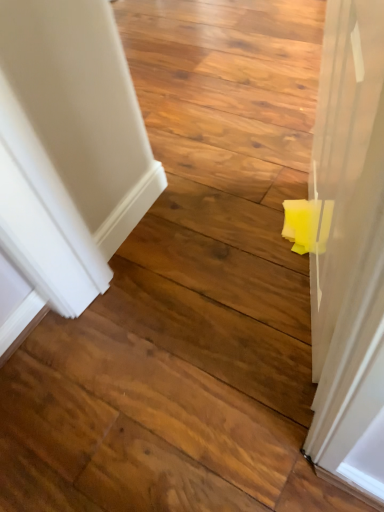
The width and height of the screenshot is (384, 512). What do you see at coordinates (349, 253) in the screenshot? I see `yellow sponge at right` at bounding box center [349, 253].

The width and height of the screenshot is (384, 512). In order to click on yellow sponge at right in this screenshot , I will do (x=349, y=253).

What is the approximate height of yellow sponge at right?

yellow sponge at right is 27.25 inches in height.

You are a GUI agent. You are given a task and a screenshot of the screen. Output one action in this format:
    pyautogui.click(x=<x>, y=<y>)
    Task: Click on the yellow sponge at right
    The image size is (384, 512).
    Given the screenshot: What is the action you would take?
    pyautogui.click(x=349, y=253)